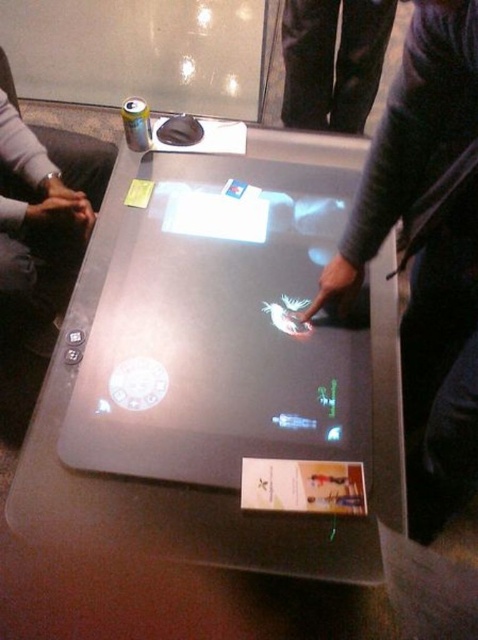
Question: Is matte black laptop at center thinner than white matte card game at center?

Choices:
 (A) no
 (B) yes

Answer: (A)

Question: Which point is closer to the camera?

Choices:
 (A) white matte card game at center
 (B) black jeans at upper center

Answer: (A)

Question: Which of the following is the closest to the observer?

Choices:
 (A) (308, 490)
 (B) (162, 285)

Answer: (A)

Question: Is matte black laptop at center bigger than black jeans at upper center?

Choices:
 (A) yes
 (B) no

Answer: (A)

Question: Which object appears closest to the camera in this image?

Choices:
 (A) black jeans at upper center
 (B) white matte card game at center
 (C) matte black laptop at center

Answer: (B)

Question: Does matte black laptop at center appear on the right side of white matte card game at center?

Choices:
 (A) yes
 (B) no

Answer: (B)